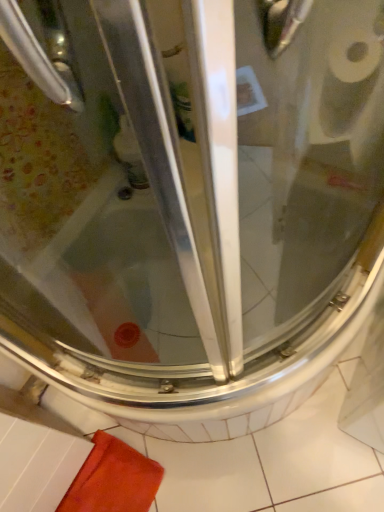
Where is `orange cotton bath towel at lower left`? The image size is (384, 512). orange cotton bath towel at lower left is located at coordinates (113, 479).

The height and width of the screenshot is (512, 384). What do you see at coordinates (113, 479) in the screenshot? I see `orange cotton bath towel at lower left` at bounding box center [113, 479].

Locate an element on the screen. orange cotton bath towel at lower left is located at coordinates (113, 479).